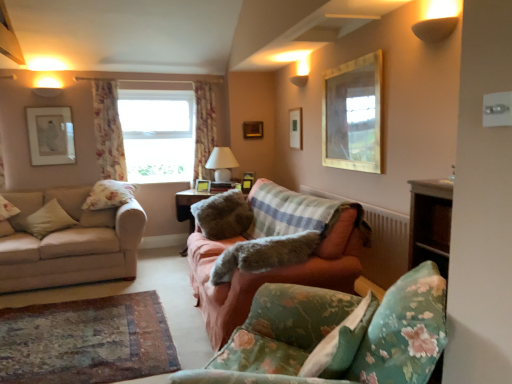
Question: Considering the positions of fluffy white pillow at left, which is counted as the 2th pillow, starting from the left, and floral fabric pillow at lower right, which is the 4th pillow from left to right, in the image, is fluffy white pillow at left, which is counted as the 2th pillow, starting from the left, taller or shorter than floral fabric pillow at lower right, which is the 4th pillow from left to right,?

Choices:
 (A) tall
 (B) short

Answer: (B)

Question: Is fluffy white pillow at left, placed as the 4th pillow when sorted from front to back, to the left or to the right of floral fabric pillow at lower right, which ranks as the 1th pillow in right-to-left order, in the image?

Choices:
 (A) left
 (B) right

Answer: (A)

Question: Which of these objects is positioned closest to the fluffy fabric pillow at center, placed as the second pillow when sorted from front to back?

Choices:
 (A) floral fabric sofa at lower right, marked as the 3th studio couch in a left-to-right arrangement
 (B) wooden picture frame at center, which appears as the 4th picture frame when viewed from the right
 (C) wooden picture frame at center, the 1th picture frame viewed from the back
 (D) pink fabric couch at center, which appears as the 2th studio couch when viewed from the right
 (E) gold textured picture frame at upper right, the first picture frame positioned from the front

Answer: (D)

Question: Which object is the closest to the fluffy fabric pillow at center, placed as the second pillow when sorted from front to back?

Choices:
 (A) wooden picture frame at center, which is the 5th picture frame from right to left
 (B) wooden picture frame at upper center, the 5th picture frame when ordered from left to right
 (C) wooden picture frame at center, which is counted as the third picture frame, starting from the back
 (D) matte white picture frame at upper left, which is the 6th picture frame from right to left
 (E) floral fabric curtain at upper left, marked as the first curtain in a left-to-right arrangement

Answer: (C)